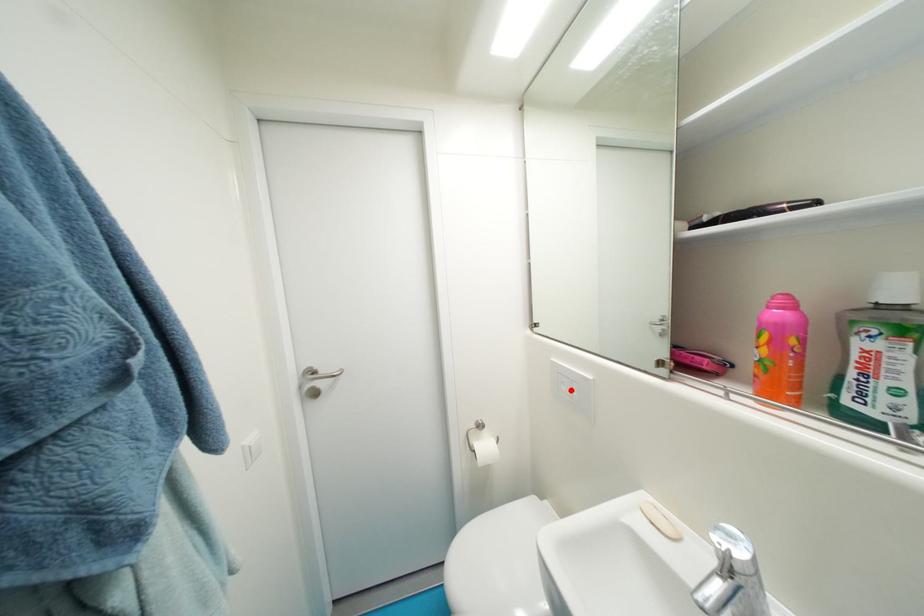
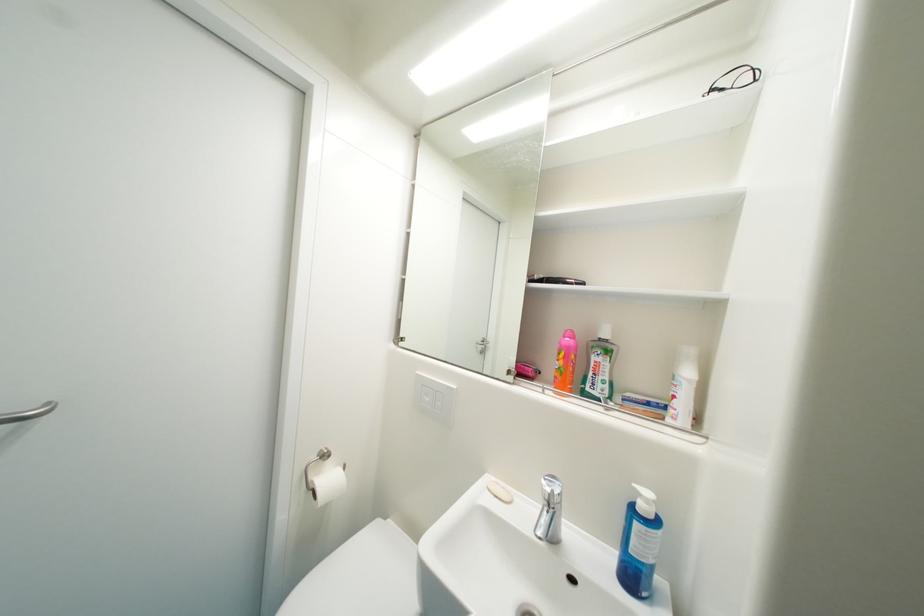
Locate, in the second image, the point that corresponds to the highlighted location in the first image.

(433, 400)